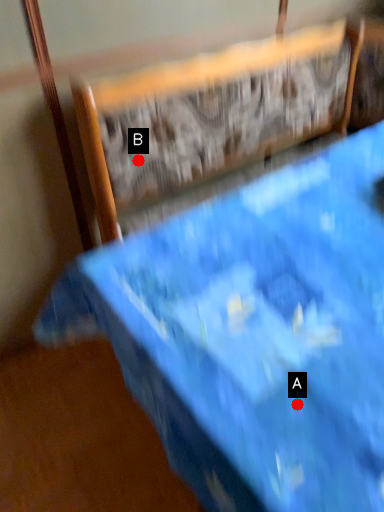
Question: Two points are circled on the image, labeled by A and B beside each circle. Which point is farther to the camera?

Choices:
 (A) A is further
 (B) B is further

Answer: (B)